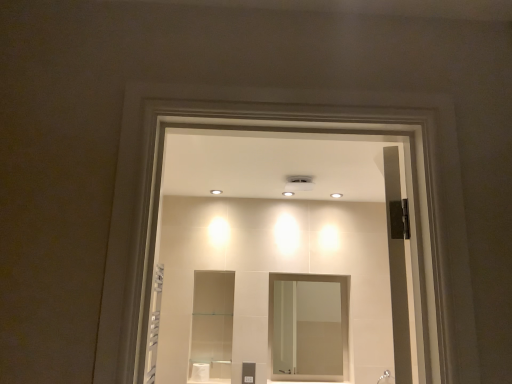
Question: From the image's perspective, is white glossy shower head at lower right located beneath clear glass mirror at center?

Choices:
 (A) yes
 (B) no

Answer: (A)

Question: Is white glossy shower head at lower right at the right side of clear glass mirror at center?

Choices:
 (A) no
 (B) yes

Answer: (B)

Question: Is white glossy shower head at lower right facing towards clear glass mirror at center?

Choices:
 (A) no
 (B) yes

Answer: (A)

Question: Is clear glass mirror at center completely or partially inside white glossy shower head at lower right?

Choices:
 (A) yes
 (B) no

Answer: (B)

Question: Can you see white glossy shower head at lower right touching clear glass mirror at center?

Choices:
 (A) no
 (B) yes

Answer: (A)

Question: Is the depth of white glossy shower head at lower right less than that of clear glass mirror at center?

Choices:
 (A) yes
 (B) no

Answer: (A)

Question: Can you confirm if clear glass mirror at center is thinner than white glossy shower head at lower right?

Choices:
 (A) yes
 (B) no

Answer: (A)

Question: From a real-world perspective, is clear glass mirror at center on top of white glossy shower head at lower right?

Choices:
 (A) no
 (B) yes

Answer: (B)

Question: From a real-world perspective, is clear glass mirror at center below white glossy shower head at lower right?

Choices:
 (A) no
 (B) yes

Answer: (A)

Question: Is clear glass mirror at center not close to white glossy shower head at lower right?

Choices:
 (A) yes
 (B) no

Answer: (A)

Question: Does clear glass mirror at center appear on the left side of white glossy shower head at lower right?

Choices:
 (A) yes
 (B) no

Answer: (A)

Question: Is clear glass mirror at center bigger than white glossy shower head at lower right?

Choices:
 (A) yes
 (B) no

Answer: (A)

Question: Considering the positions of clear glass mirror at center and white glossy shower head at lower right in the image, is clear glass mirror at center wider or thinner than white glossy shower head at lower right?

Choices:
 (A) wide
 (B) thin

Answer: (B)